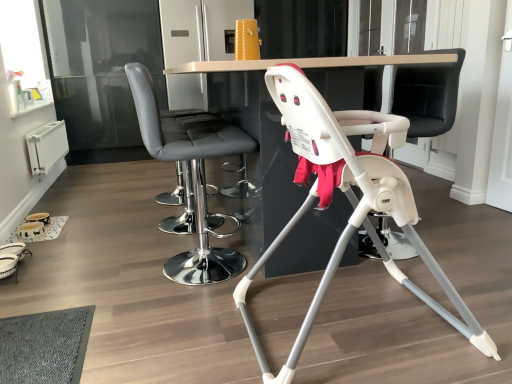
This screenshot has width=512, height=384. I want to click on free space between white plastic highchair at center, which is the first chair in right-to-left order, and white glossy table at center, so click(335, 315).